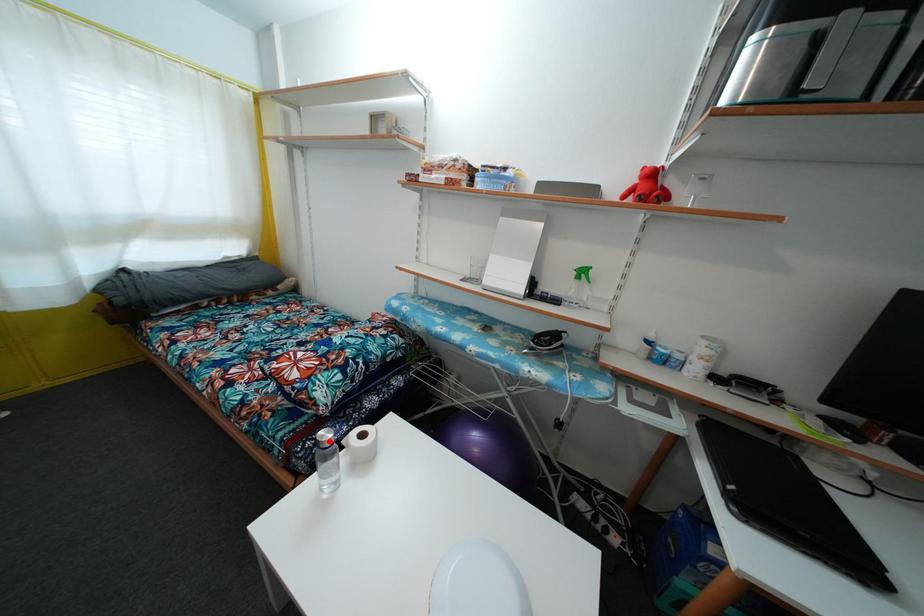
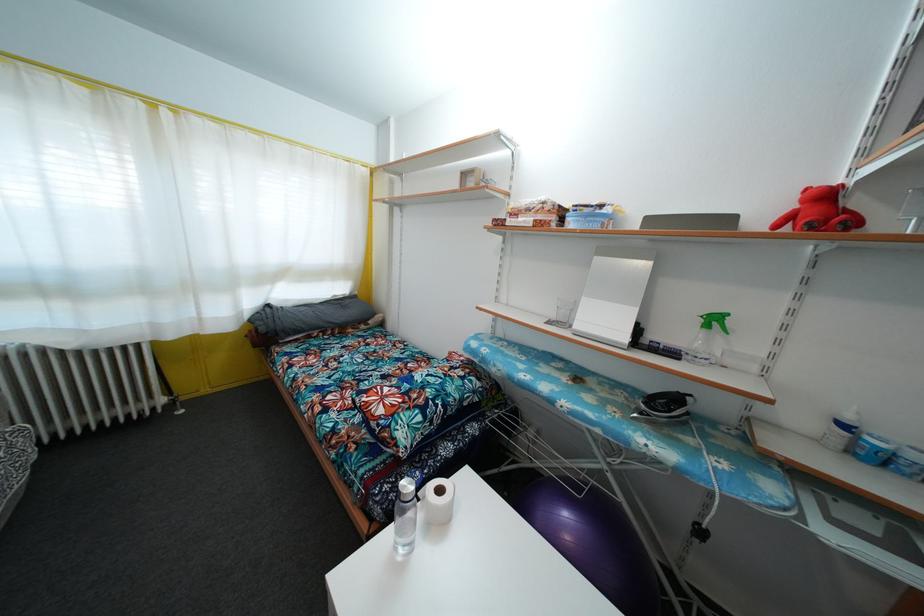
Where in the second image is the point corresponding to the highlighted location from the first image?

(410, 492)